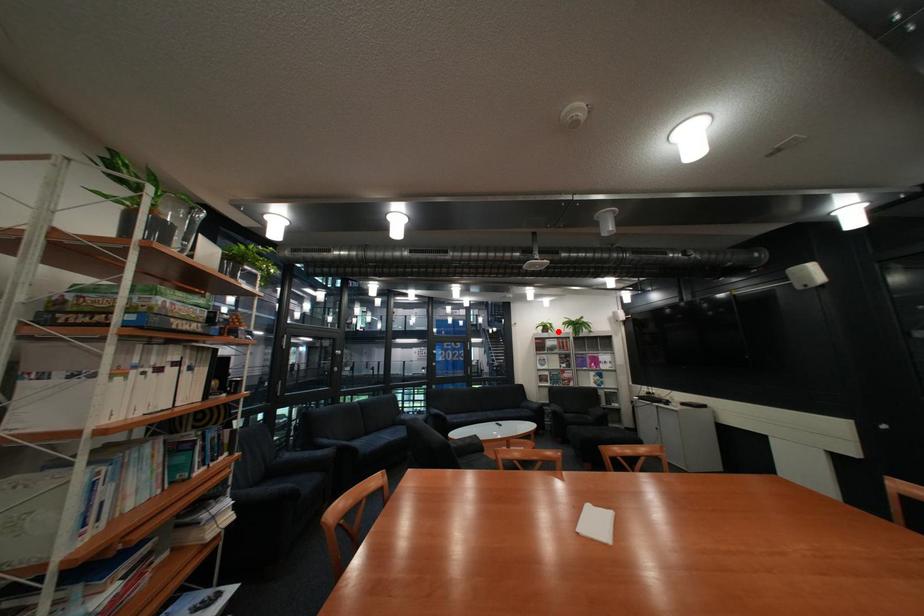
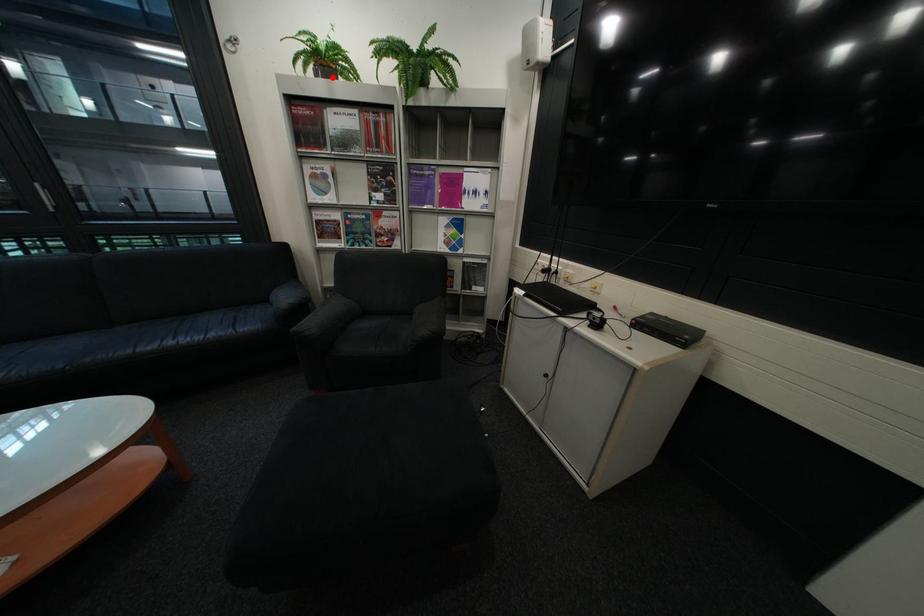
I am providing you with two images of the same scene from different viewpoints. A red point is marked on the first image and another point is marked on the second image. Are the points marked in image1 and image2 representing the same 3D position?

Yes